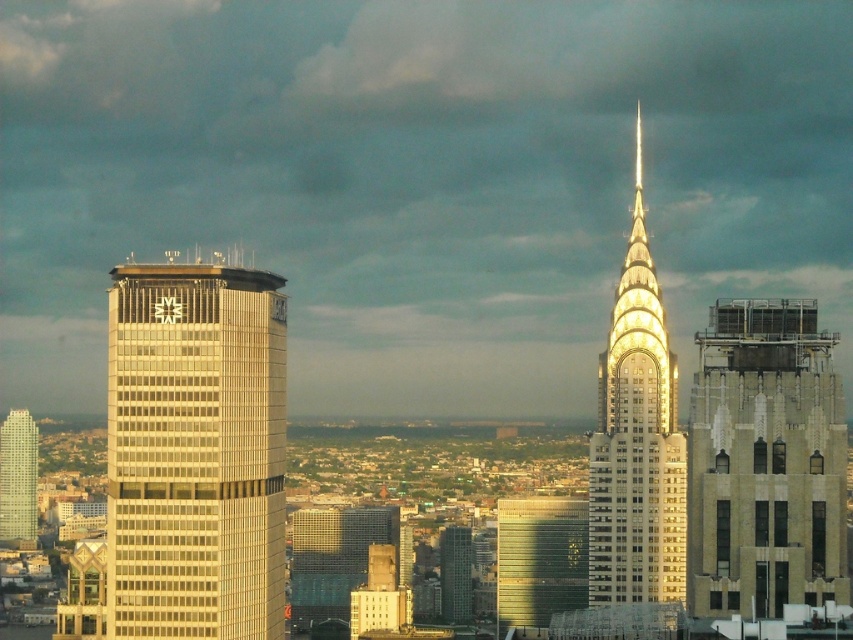
Question: Is silver glass skyscraper at left to the left of beige concrete building at center from the viewer's perspective?

Choices:
 (A) yes
 (B) no

Answer: (A)

Question: Is shiny gold skyscraper at center closer to camera compared to metallic glass building at center?

Choices:
 (A) yes
 (B) no

Answer: (A)

Question: Which is farther from the shiny gold skyscraper at center?

Choices:
 (A) metallic glass building at center
 (B) silver glass skyscraper at left
 (C) stone textured building at right

Answer: (B)

Question: Is the position of silver glass skyscraper at left less distant than that of green glass building at center?

Choices:
 (A) no
 (B) yes

Answer: (B)

Question: Which point appears closest to the camera in this image?

Choices:
 (A) (467, 529)
 (B) (564, 573)
 (C) (1, 428)

Answer: (A)

Question: Which object appears closest to the camera in this image?

Choices:
 (A) metallic glass building at center
 (B) beige concrete building at center
 (C) matte glass skyscraper at left
 (D) silver glass skyscraper at left

Answer: (D)